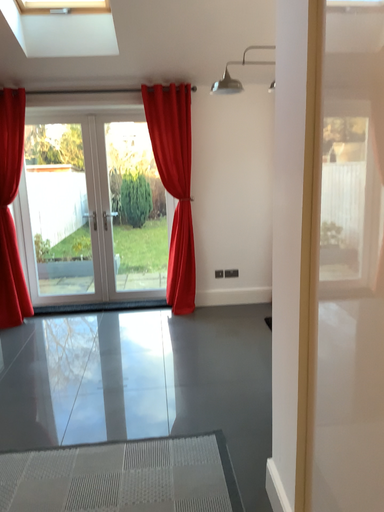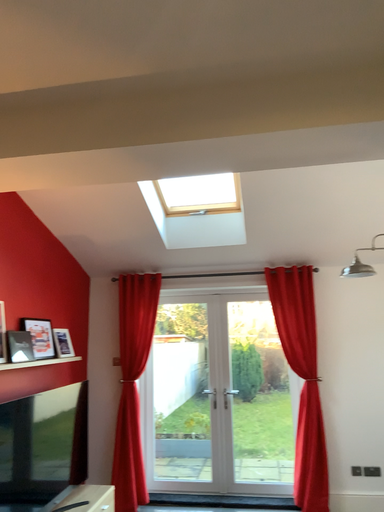
Question: How did the camera likely rotate when shooting the video?

Choices:
 (A) rotated right
 (B) rotated left

Answer: (B)